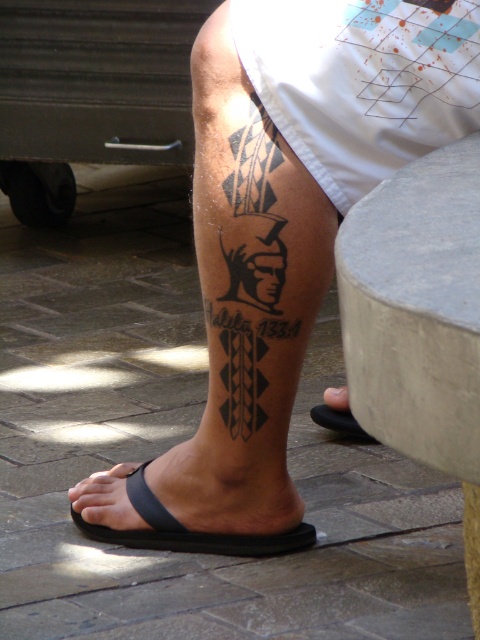
Question: Is black matte sandal at lower left positioned behind black rubber sandal at lower left?

Choices:
 (A) yes
 (B) no

Answer: (B)

Question: Which object is the closest to the black matte sandal at lower left?

Choices:
 (A) black rubber sandal at lower left
 (B) black ink tattoo at lower center
 (C) white cotton shorts at upper right

Answer: (B)

Question: Which object is the farthest from the black matte sandal at lower left?

Choices:
 (A) white cotton shorts at upper right
 (B) black ink tattoo at lower center
 (C) black rubber sandal at lower left

Answer: (A)

Question: Can you confirm if black matte sandal at lower left is smaller than black rubber sandal at lower left?

Choices:
 (A) yes
 (B) no

Answer: (B)

Question: Among these points, which one is nearest to the camera?

Choices:
 (A) (142, 486)
 (B) (409, 3)
 (C) (354, 432)
 (D) (197, 234)

Answer: (B)

Question: Can you confirm if black ink tattoo at lower center is smaller than black rubber sandal at lower left?

Choices:
 (A) no
 (B) yes

Answer: (A)